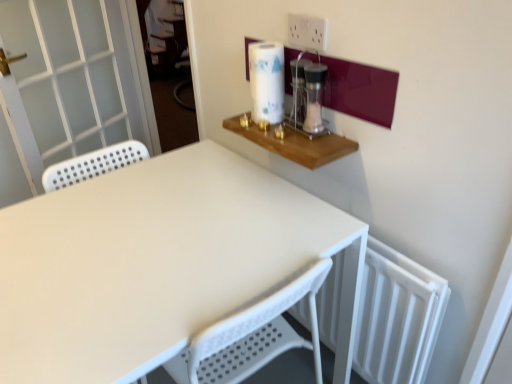
Question: From the image's perspective, is white glossy paper towel at upper right on top of white perforated screen door at left?

Choices:
 (A) no
 (B) yes

Answer: (A)

Question: Would you say white glossy paper towel at upper right is outside white perforated screen door at left?

Choices:
 (A) yes
 (B) no

Answer: (A)

Question: Does white glossy paper towel at upper right have a smaller size compared to white perforated screen door at left?

Choices:
 (A) yes
 (B) no

Answer: (A)

Question: Does white glossy paper towel at upper right turn towards white perforated screen door at left?

Choices:
 (A) yes
 (B) no

Answer: (B)

Question: From a real-world perspective, is white glossy paper towel at upper right located beneath white perforated screen door at left?

Choices:
 (A) no
 (B) yes

Answer: (A)

Question: Is white matte table at center spatially inside white perforated screen door at left, or outside of it?

Choices:
 (A) outside
 (B) inside

Answer: (A)

Question: In terms of width, does white matte table at center look wider or thinner when compared to white perforated screen door at left?

Choices:
 (A) wide
 (B) thin

Answer: (A)

Question: In the image, is white matte table at center on the left side or the right side of white perforated screen door at left?

Choices:
 (A) left
 (B) right

Answer: (B)

Question: Is white matte table at center in front of or behind white perforated screen door at left in the image?

Choices:
 (A) front
 (B) behind

Answer: (A)

Question: Is white perforated screen door at left taller or shorter than white glossy paper towel at upper right?

Choices:
 (A) tall
 (B) short

Answer: (A)

Question: From the image's perspective, is white perforated screen door at left positioned above or below white glossy paper towel at upper right?

Choices:
 (A) above
 (B) below

Answer: (A)

Question: Is white perforated screen door at left in front of or behind white glossy paper towel at upper right in the image?

Choices:
 (A) front
 (B) behind

Answer: (B)

Question: In terms of size, does white perforated screen door at left appear bigger or smaller than white glossy paper towel at upper right?

Choices:
 (A) big
 (B) small

Answer: (A)

Question: Based on their sizes in the image, would you say white matte table at center is bigger or smaller than clear glass jar at upper right?

Choices:
 (A) small
 (B) big

Answer: (B)

Question: Is point (294, 273) positioned closer to the camera than point (293, 74)?

Choices:
 (A) farther
 (B) closer

Answer: (B)